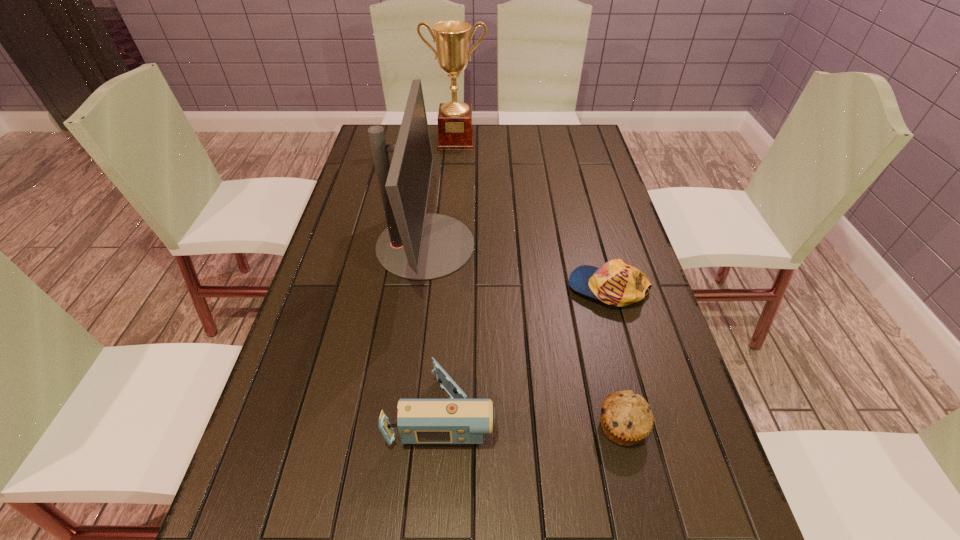
Identify the location of free space located 0.110m on the bill of the cap. The height and width of the screenshot is (540, 960). (526, 288).

At what (x,y) coordinates should I click in order to perform the action: click on vacant space located on the front of the muffin. Please return your answer as a coordinate pair (x, y). The image size is (960, 540). Looking at the image, I should click on (648, 539).

This screenshot has height=540, width=960. In order to click on object located at the far edge in this screenshot , I will do `click(452, 39)`.

Find the location of a particular element. object positioned at the left edge is located at coordinates (416, 245).

What are the coordinates of `cap that is at the right edge` in the screenshot? It's located at (617, 283).

Locate an element on the screen. muffin situated at the right edge is located at coordinates (626, 418).

Find the location of a particular element. The width and height of the screenshot is (960, 540). vacant point at the far edge is located at coordinates tap(476, 127).

Identify the location of vacant space at the left edge of the desktop. (354, 190).

Identify the location of vacant space at the right edge of the desktop. The width and height of the screenshot is (960, 540). (565, 176).

The width and height of the screenshot is (960, 540). In order to click on free spot at the far left corner of the desktop in this screenshot , I will do `click(389, 143)`.